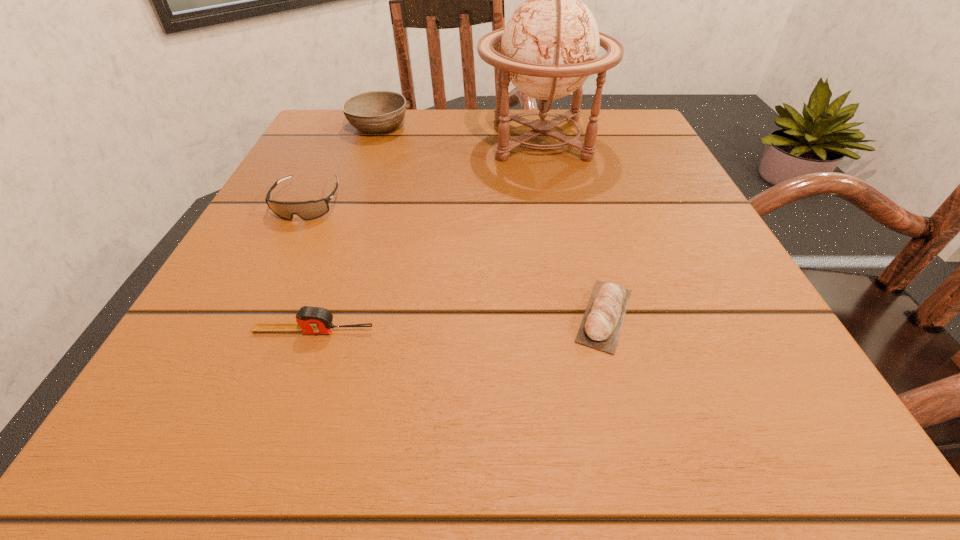
Find the location of `the tallest object`. the tallest object is located at coordinates (549, 47).

Identify the location of bowl. This screenshot has width=960, height=540. (375, 112).

Find the location of a particular element. The image size is (960, 540). the third nearest object is located at coordinates (307, 210).

Where is `tape measure`? The width and height of the screenshot is (960, 540). tape measure is located at coordinates (311, 320).

Where is `the shortest object`? Image resolution: width=960 pixels, height=540 pixels. the shortest object is located at coordinates (608, 302).

Where is `vacant region located 0.290m on the front-facing side of the tallest object`? The image size is (960, 540). vacant region located 0.290m on the front-facing side of the tallest object is located at coordinates (342, 139).

Image resolution: width=960 pixels, height=540 pixels. In order to click on free location located on the front-facing side of the tallest object in this screenshot , I will do `click(421, 139)`.

Locate an element on the screen. This screenshot has height=540, width=960. free space located on the front-facing side of the tallest object is located at coordinates (408, 139).

You are a GUI agent. You are given a task and a screenshot of the screen. Output one action in this format:
    pyautogui.click(x=<x>, y=<y>)
    Task: Click on the vacant space located on the left of the bowl
    The image size is (960, 540).
    Given the screenshot: What is the action you would take?
    pyautogui.click(x=321, y=126)

Find the location of a particular element. The image size is (960, 540). vacant area located on the lenses of the goggles is located at coordinates (228, 365).